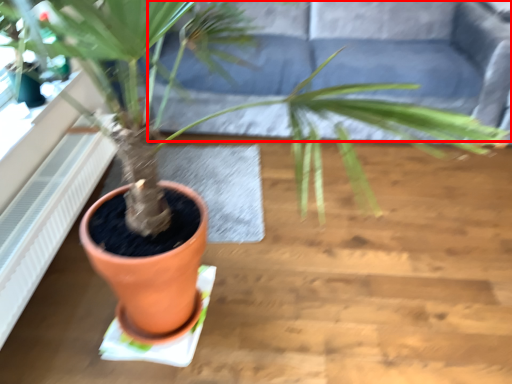
Question: From the image's perspective, where is couch (annotated by the red box) located relative to radiator?

Choices:
 (A) above
 (B) below

Answer: (A)